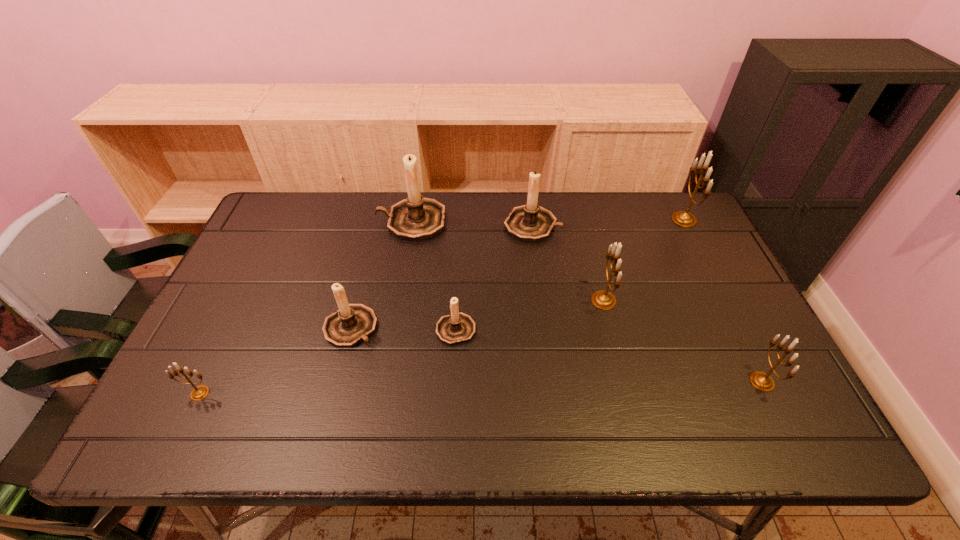
Identify the location of vacant space in between the fifth object from right to left and the rightmost brown candle holder. (494, 276).

Locate an element on the screen. free area in between the fourth object from left to right and the fifth object from left to right is located at coordinates (494, 276).

Find the location of a particular element. vacant area that lies between the biggest brown candle holder and the second biggest brown candle holder is located at coordinates (471, 223).

Where is `vacant region between the third smallest brown candle holder and the third brown candle holder from left to right`? vacant region between the third smallest brown candle holder and the third brown candle holder from left to right is located at coordinates (494, 276).

Identify the location of vacant area that lies between the second smallest brown candle holder and the fourth candelabrum from right to left. (442, 276).

Find the location of a particular element. Image resolution: width=960 pixels, height=540 pixels. free space that is in between the second gold candelabrum from left to right and the rightmost brown candle holder is located at coordinates (568, 263).

Where is `the fifth closest object to the smallest gold candelabrum`? the fifth closest object to the smallest gold candelabrum is located at coordinates (604, 300).

Where is `the sixth closest object to the second smallest brown candle holder`? This screenshot has height=540, width=960. the sixth closest object to the second smallest brown candle holder is located at coordinates pyautogui.click(x=762, y=381).

Locate an element on the screen. This screenshot has width=960, height=540. candelabrum that can be found as the third closest to the fourth candelabrum from right to left is located at coordinates (456, 328).

Identify which candelabrum is the closest to the biggest brown candle holder. Please provide its 2D coordinates. Your answer should be formatted as a tuple, i.e. [(x, y)], where the tuple contains the x and y coordinates of a point satisfying the conditions above.

[(530, 222)]